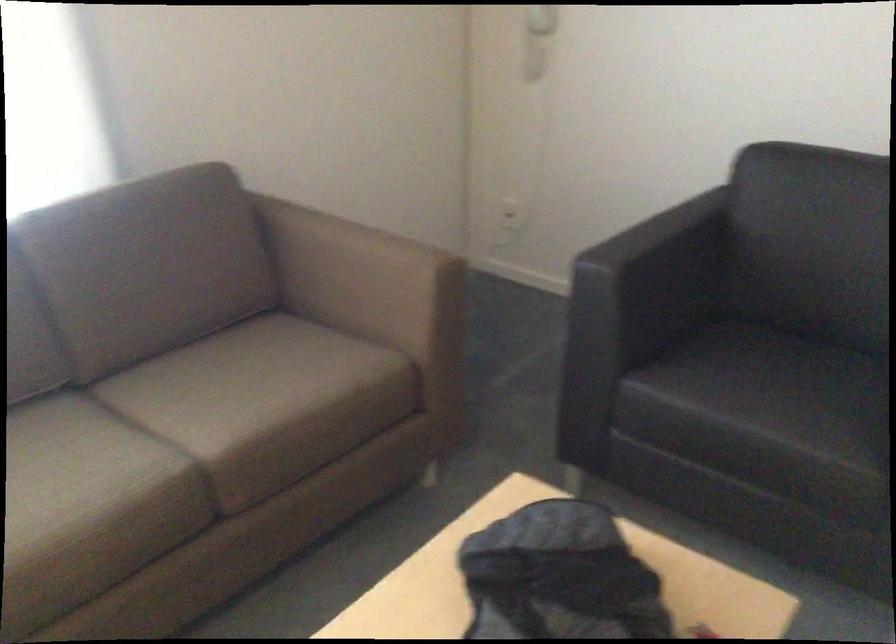
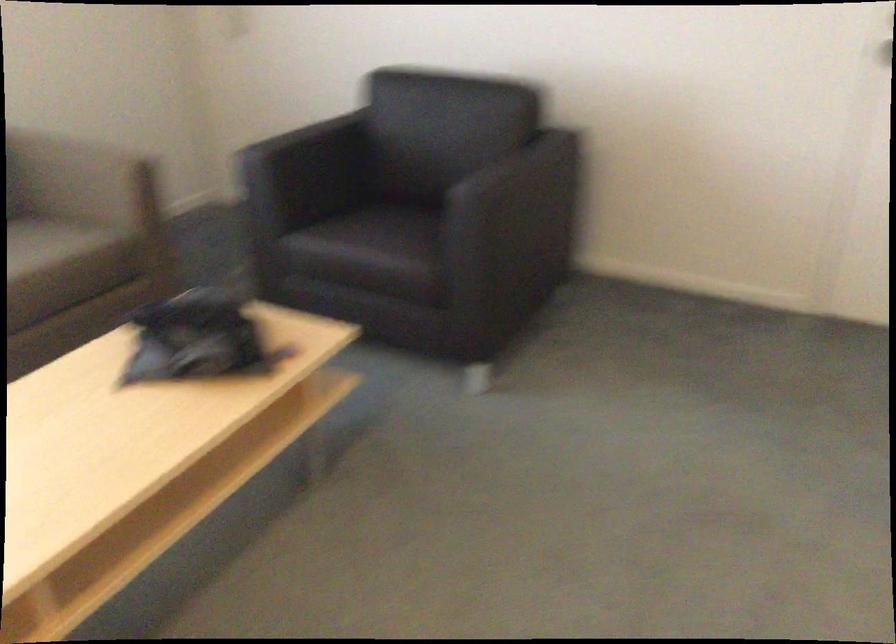
In the second image, find the point that corresponds to (x=759, y=408) in the first image.

(368, 240)